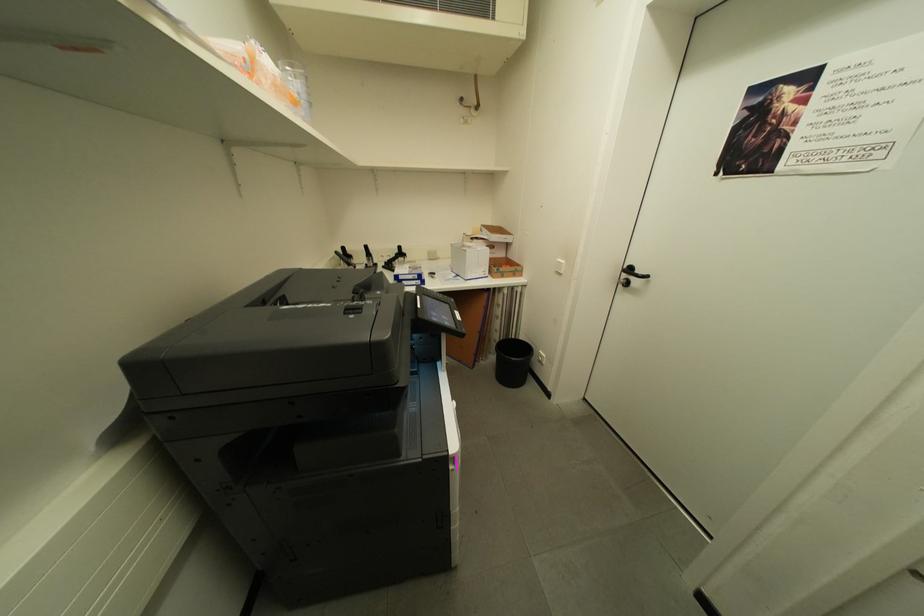
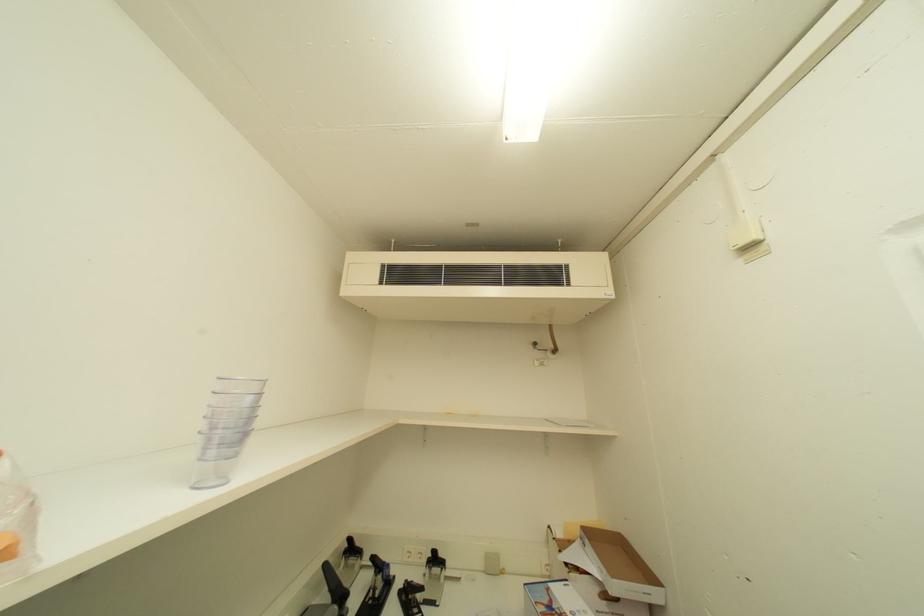
The first image is from the beginning of the video and the second image is from the end. How did the camera likely rotate when shooting the video?

The camera rotated toward left-up.